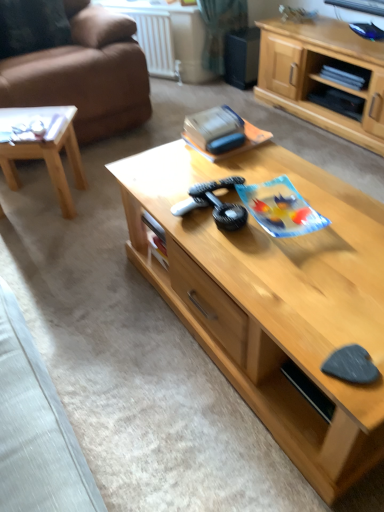
Question: Would you say light wood cabinet at center is part of velvet dark brown pillow at upper left's contents?

Choices:
 (A) yes
 (B) no

Answer: (B)

Question: Is velvet dark brown pillow at upper left next to light wood cabinet at center and touching it?

Choices:
 (A) no
 (B) yes

Answer: (A)

Question: Is velvet dark brown pillow at upper left bigger than light wood cabinet at center?

Choices:
 (A) yes
 (B) no

Answer: (B)

Question: Can you confirm if velvet dark brown pillow at upper left is positioned to the right of light wood cabinet at center?

Choices:
 (A) no
 (B) yes

Answer: (A)

Question: From a real-world perspective, does velvet dark brown pillow at upper left stand above light wood cabinet at center?

Choices:
 (A) no
 (B) yes

Answer: (B)

Question: Is velvet dark brown pillow at upper left outside light wood cabinet at center?

Choices:
 (A) no
 (B) yes

Answer: (B)

Question: Does brown leather couch at left have a lesser height compared to light wood cabinet at center?

Choices:
 (A) no
 (B) yes

Answer: (A)

Question: Can you confirm if brown leather couch at left is taller than light wood cabinet at center?

Choices:
 (A) no
 (B) yes

Answer: (B)

Question: Is the position of brown leather couch at left less distant than that of light wood cabinet at center?

Choices:
 (A) yes
 (B) no

Answer: (A)

Question: Is brown leather couch at left beside light wood cabinet at center?

Choices:
 (A) no
 (B) yes

Answer: (A)

Question: Is brown leather couch at left to the right of light wood cabinet at center from the viewer's perspective?

Choices:
 (A) no
 (B) yes

Answer: (A)

Question: Is brown leather couch at left bigger than light wood cabinet at center?

Choices:
 (A) no
 (B) yes

Answer: (B)

Question: From a real-world perspective, is velvet dark brown pillow at upper left under light wood coffee table at center, acting as the 1th coffee table starting from the right?

Choices:
 (A) yes
 (B) no

Answer: (B)